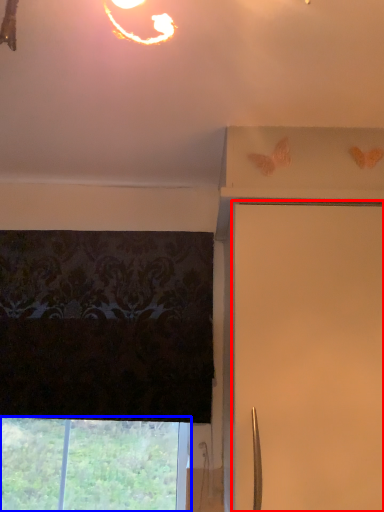
Question: Which object appears farthest to the camera in this image, shutter (highlighted by a red box) or window (highlighted by a blue box)?

Choices:
 (A) shutter
 (B) window

Answer: (B)